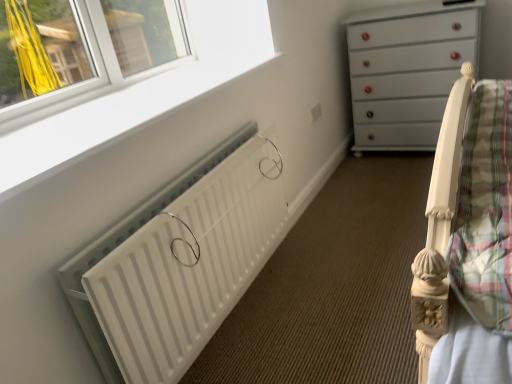
Question: Would you say white glossy chest of drawers at upper right is inside or outside white matte radiator at lower left?

Choices:
 (A) inside
 (B) outside

Answer: (B)

Question: Is point (352, 89) closer or farther from the camera than point (148, 233)?

Choices:
 (A) farther
 (B) closer

Answer: (A)

Question: Considering the real-world distances, which object is farthest from the white matte radiator at lower left?

Choices:
 (A) white glossy chest of drawers at upper right
 (B) white plastic window frame at upper left

Answer: (A)

Question: Which object is positioned closest to the white glossy chest of drawers at upper right?

Choices:
 (A) white plastic window frame at upper left
 (B) white matte radiator at lower left

Answer: (A)